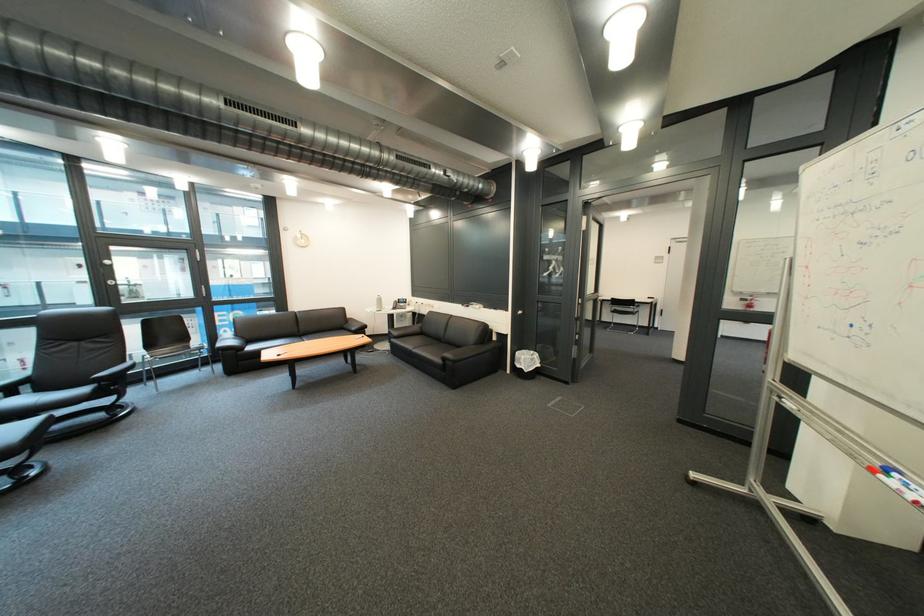
Locate an element on the screen. Image resolution: width=924 pixels, height=616 pixels. vertical door handle is located at coordinates 529,315.